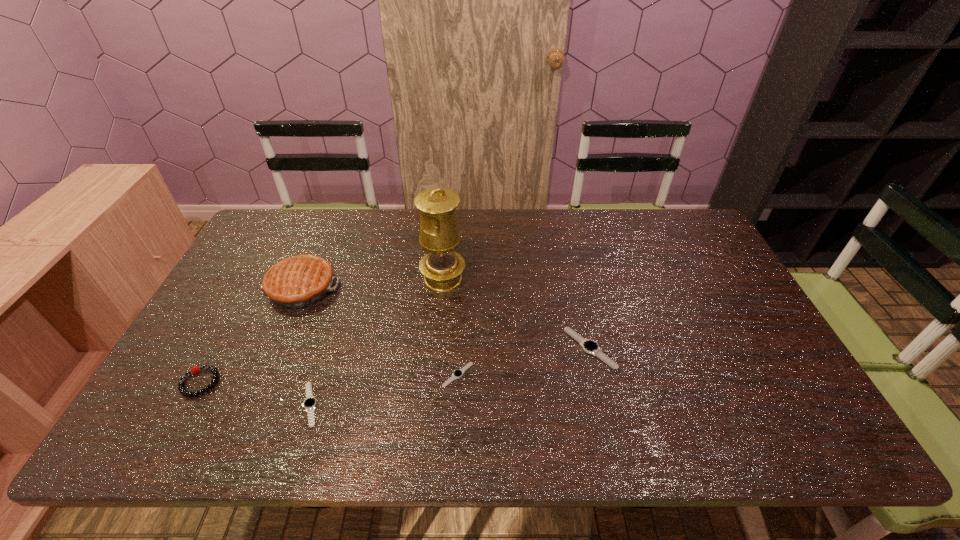
At what (x,y) coordinates should I click in order to perform the action: click on free space located on the right of the shortest object. Please return your answer as a coordinate pair (x, y). The width and height of the screenshot is (960, 540). Looking at the image, I should click on (530, 375).

The width and height of the screenshot is (960, 540). I want to click on vacant region located 0.390m on the left of the rightmost object, so pyautogui.click(x=418, y=348).

This screenshot has height=540, width=960. I want to click on vacant space located on the front of the oil lamp, so click(441, 307).

At what (x,y) coordinates should I click in order to perform the action: click on vacant space situated on the front of the second tallest object. Please return your answer as a coordinate pair (x, y). The height and width of the screenshot is (540, 960). Looking at the image, I should click on (265, 374).

The image size is (960, 540). In order to click on free location located on the back of the fourth shortest object in this screenshot , I will do `click(228, 330)`.

The image size is (960, 540). I want to click on bracelet located at the near edge, so click(x=181, y=388).

Image resolution: width=960 pixels, height=540 pixels. Find the location of `pie located in the left edge section of the desktop`. pie located in the left edge section of the desktop is located at coordinates (295, 282).

Where is `bracelet situated at the left edge`? This screenshot has width=960, height=540. bracelet situated at the left edge is located at coordinates (181, 388).

The width and height of the screenshot is (960, 540). Identify the location of object at the near left corner. (181, 388).

The image size is (960, 540). I want to click on vacant space at the far edge of the desktop, so click(x=498, y=208).